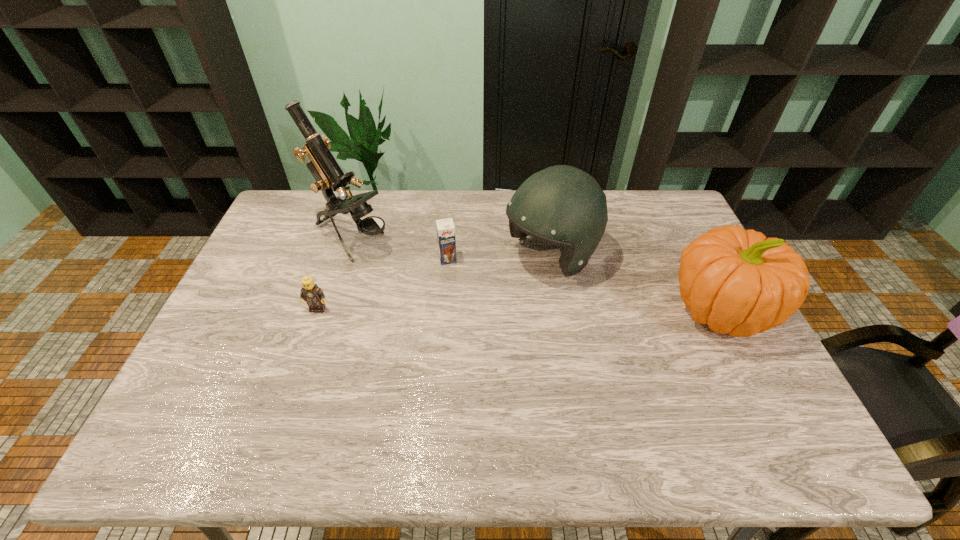
You are a GUI agent. You are given a task and a screenshot of the screen. Output one action in this format:
    pyautogui.click(x=<x>, y=<y>)
    Task: Click on the vacant space located on the front label of the third object from left to right
    The width and height of the screenshot is (960, 540).
    Given the screenshot: What is the action you would take?
    pyautogui.click(x=455, y=287)

I want to click on vacant space located 0.060m on the front label of the third object from left to right, so click(x=452, y=278).

Where is `vacant space located on the front label of the third object from left to right`? The height and width of the screenshot is (540, 960). vacant space located on the front label of the third object from left to right is located at coordinates (468, 336).

I want to click on free space located at the face opening of the fourth object from left to right, so click(x=452, y=317).

Find the location of a particular element. free location located at the face opening of the fourth object from left to right is located at coordinates (476, 302).

Find the location of a particular element. This screenshot has height=540, width=960. free location located at the face opening of the fourth object from left to right is located at coordinates (494, 291).

This screenshot has width=960, height=540. Find the location of `microscope present at the far edge`. microscope present at the far edge is located at coordinates (329, 177).

Where is `football helmet that is at the far edge`? The height and width of the screenshot is (540, 960). football helmet that is at the far edge is located at coordinates (562, 205).

Image resolution: width=960 pixels, height=540 pixels. What are the coordinates of `object present at the left edge` in the screenshot? It's located at (329, 177).

Where is `object that is at the right edge`? This screenshot has width=960, height=540. object that is at the right edge is located at coordinates (737, 281).